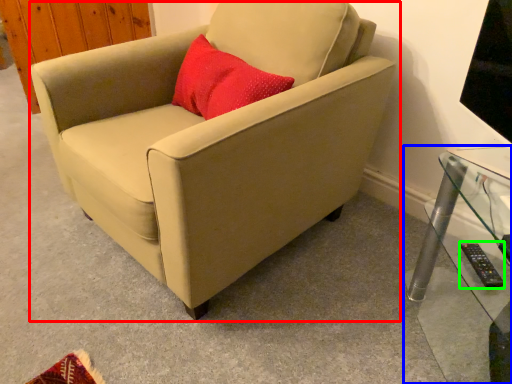
Question: Based on their relative distances, which object is farther from chair (highlighted by a red box)? Choose from table (highlighted by a blue box) and remote (highlighted by a green box).

Choices:
 (A) table
 (B) remote

Answer: (B)